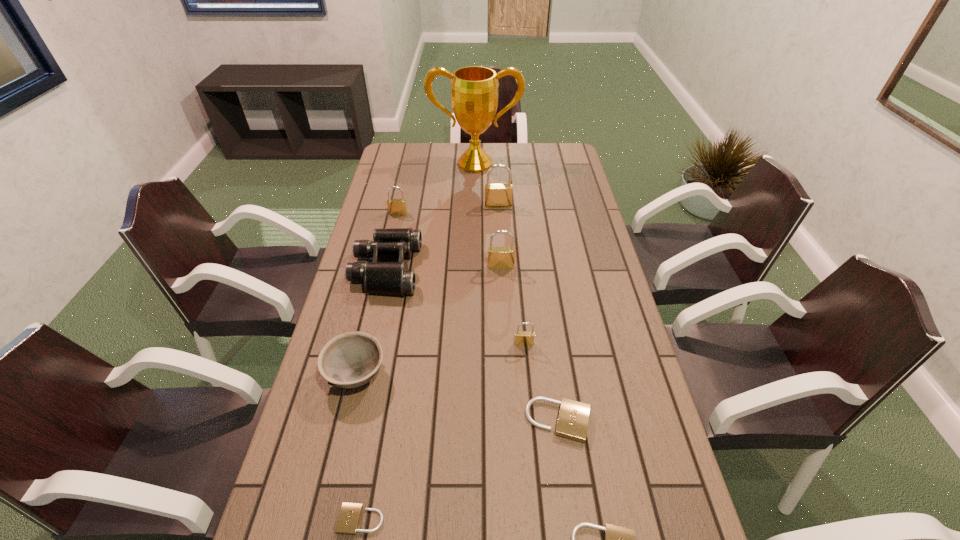
The width and height of the screenshot is (960, 540). In order to click on the sixth farthest object in this screenshot , I will do `click(522, 338)`.

The width and height of the screenshot is (960, 540). In order to click on gray bowl in this screenshot , I will do pos(349,360).

The height and width of the screenshot is (540, 960). What are the coordinates of `the eighth tallest object` in the screenshot? It's located at (573, 418).

Locate an element on the screen. the biggest beige padlock is located at coordinates point(573,418).

What are the coordinates of `the shortest object` in the screenshot? It's located at (349, 517).

Locate an element on the screen. The image size is (960, 540). the smallest beige padlock is located at coordinates (349, 517).

The image size is (960, 540). I want to click on vacant space positioned on the front-facing side of the tallest object, so click(474, 224).

Identify the location of free location located on the front-facing side of the second farthest object. This screenshot has width=960, height=540. (502, 277).

Locate an element on the screen. The image size is (960, 540). vacant position located on the front-facing side of the second nearest brass padlock is located at coordinates (504, 328).

This screenshot has width=960, height=540. I want to click on free space located 0.190m on the front-facing side of the second farthest brass padlock, so click(x=391, y=248).